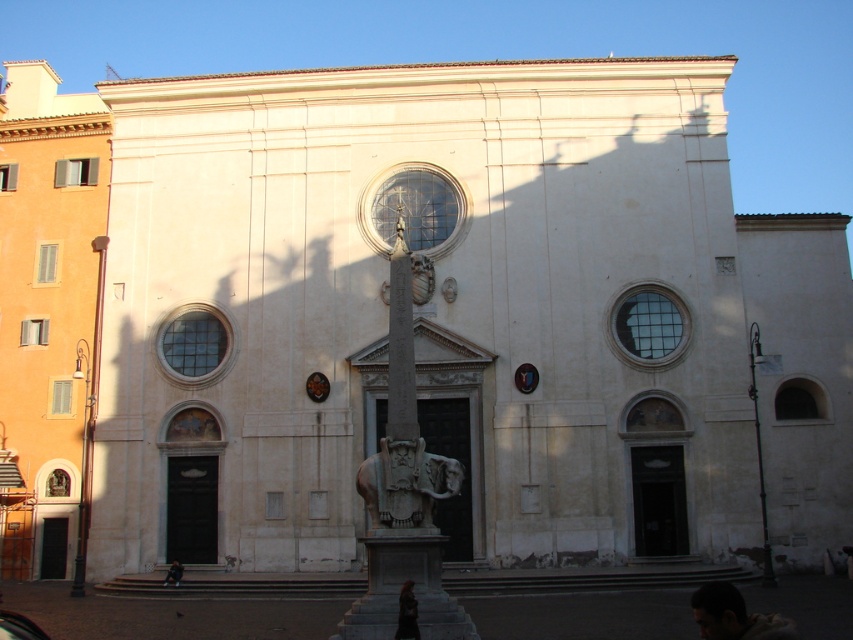
Can you confirm if dark hair human head at lower right is smaller than dark hair human at lower center?

Incorrect, dark hair human head at lower right is not smaller in size than dark hair human at lower center.

Is dark hair human head at lower right bigger than dark hair human at lower center?

Indeed, dark hair human head at lower right has a larger size compared to dark hair human at lower center.

Image resolution: width=853 pixels, height=640 pixels. Describe the element at coordinates (734, 616) in the screenshot. I see `dark hair human head at lower right` at that location.

You are a GUI agent. You are given a task and a screenshot of the screen. Output one action in this format:
    pyautogui.click(x=<x>, y=<y>)
    Task: Click on the dark hair human head at lower right
    The width and height of the screenshot is (853, 640).
    Given the screenshot: What is the action you would take?
    pyautogui.click(x=734, y=616)

Is dark hair human head at lower right behind dark hair at center?

That is False.

Which is in front, point (705, 595) or point (403, 598)?

Positioned in front is point (705, 595).

Find the location of a particular element. Image resolution: width=853 pixels, height=640 pixels. dark hair human head at lower right is located at coordinates (734, 616).

Is dark hair at center smaller than dark hair human at lower center?

No.

Image resolution: width=853 pixels, height=640 pixels. Describe the element at coordinates (407, 612) in the screenshot. I see `dark hair at center` at that location.

Which is behind, point (416, 620) or point (178, 580)?

Positioned behind is point (178, 580).

The width and height of the screenshot is (853, 640). Find the location of `dark hair at center`. dark hair at center is located at coordinates (407, 612).